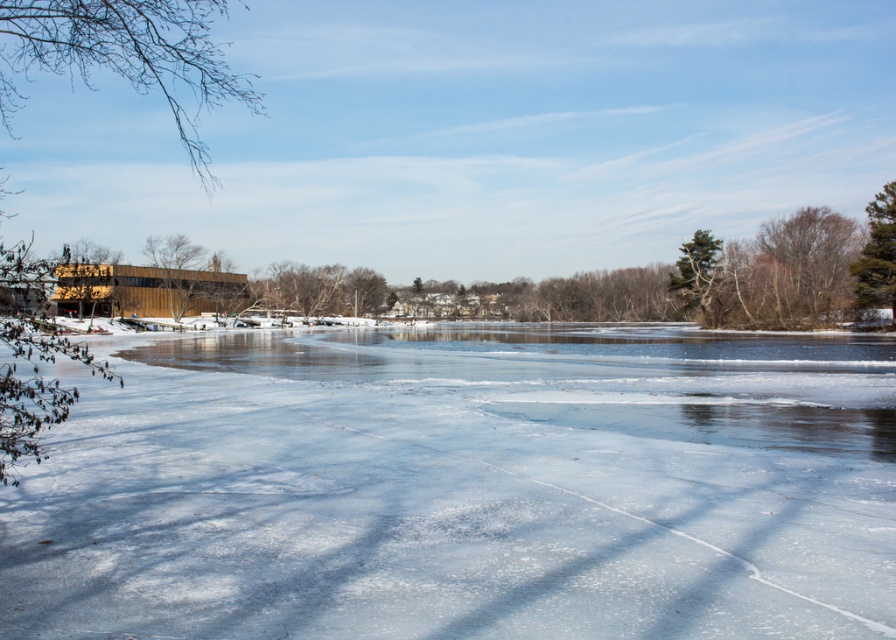
In the scene shown: Between brown wood tree at left and green textured tree at upper right, which one appears on the right side from the viewer's perspective?

green textured tree at upper right

Does brown wood tree at left have a smaller size compared to green textured tree at upper right?

No.

Which is behind, point (0, 28) or point (696, 232)?

Point (696, 232)

You are a GUI agent. You are given a task and a screenshot of the screen. Output one action in this format:
    pyautogui.click(x=<x>, y=<y>)
    Task: Click on the brown wood tree at left
    
    Given the screenshot: What is the action you would take?
    pyautogui.click(x=123, y=54)

Is green textured pine tree at right positioned at the back of green textured tree at upper right?

No, it is not.

Measure the distance between green textured pine tree at right and camera.

They are 214.24 feet apart.

Which is behind, point (893, 182) or point (688, 243)?

Positioned behind is point (688, 243).

The height and width of the screenshot is (640, 896). In order to click on green textured pine tree at right in this screenshot , I will do `click(877, 253)`.

Does bare branches at upper right lie in front of green textured pine tree at right?

That is False.

Can you confirm if bare branches at upper right is positioned to the left of green textured pine tree at right?

Indeed, bare branches at upper right is positioned on the left side of green textured pine tree at right.

Describe the element at coordinates (811, 252) in the screenshot. This screenshot has height=640, width=896. I see `bare branches at upper right` at that location.

Identify the location of bare branches at upper right. (811, 252).